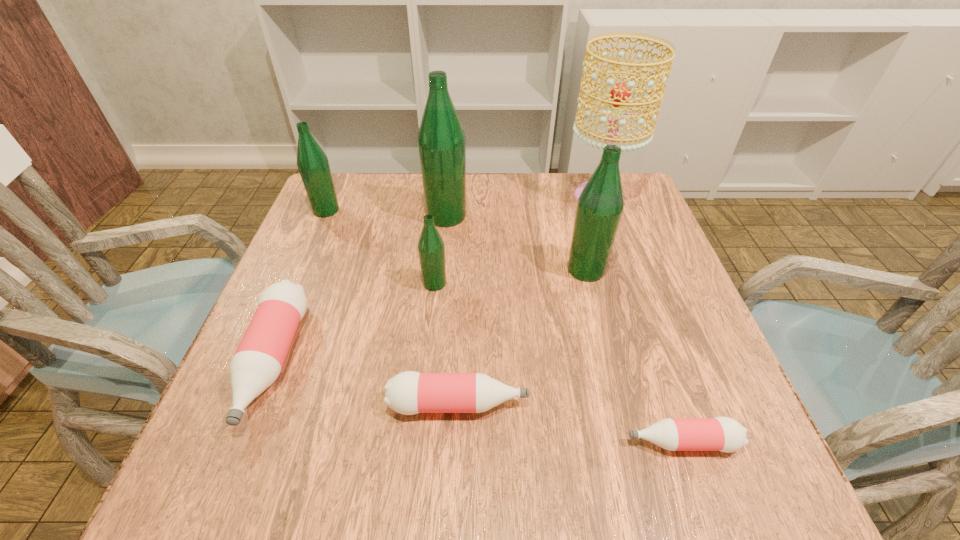
The image size is (960, 540). Find the location of `lampshade`. lampshade is located at coordinates (620, 93).

The height and width of the screenshot is (540, 960). In order to click on the tallest bottle in this screenshot , I will do `click(441, 140)`.

Where is `the rightmost green bottle`? the rightmost green bottle is located at coordinates (600, 205).

You are a GUI agent. You are given a task and a screenshot of the screen. Output one action in this format:
    pyautogui.click(x=<x>, y=<y>)
    Task: Click on the sixth shortest object
    This screenshot has width=960, height=540.
    Given the screenshot: What is the action you would take?
    pyautogui.click(x=600, y=205)

Find the location of a particular element. the leftmost green bottle is located at coordinates (313, 165).

You are a GUI agent. You are given a task and a screenshot of the screen. Output one action in this format:
    pyautogui.click(x=<x>, y=<y>)
    Task: Click on the fourth tallest object
    Image resolution: width=960 pixels, height=540 pixels.
    Given the screenshot: What is the action you would take?
    pyautogui.click(x=313, y=165)

Find the location of a particular element. the smallest green bottle is located at coordinates (431, 249).

Find the location of a particular element. the fourth shortest bottle is located at coordinates (431, 249).

The height and width of the screenshot is (540, 960). Find the location of `the biggest pink bottle`. the biggest pink bottle is located at coordinates (258, 360).

What are the coordinates of `the leftmost pink bottle` in the screenshot? It's located at (258, 360).